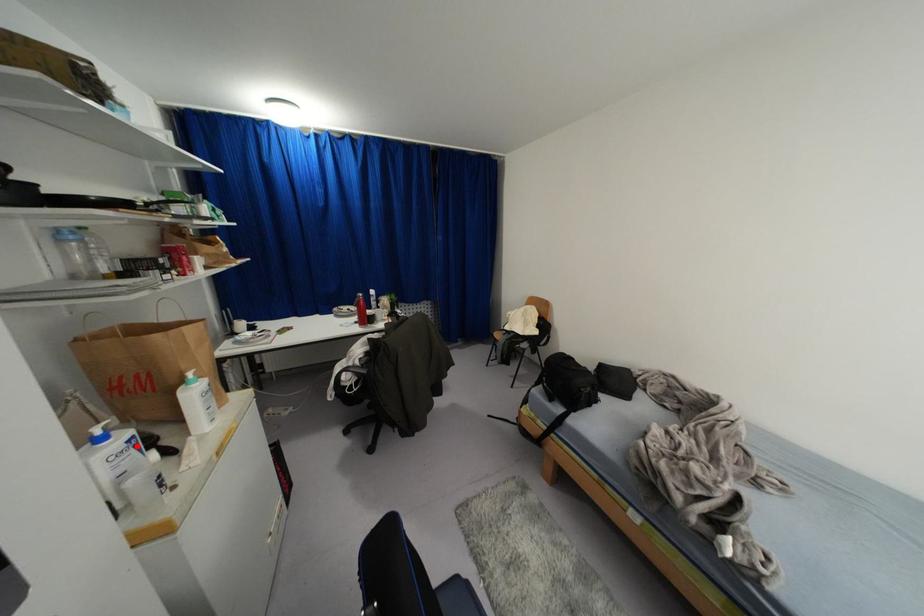
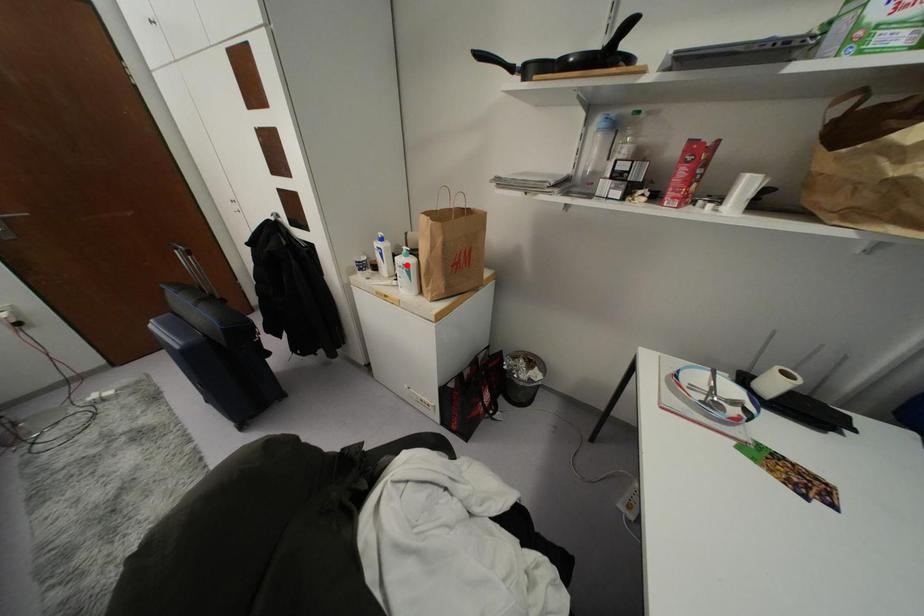
I am providing you with two images of the same scene from different viewpoints. A red point is marked on the first image and another point is marked on the second image. Is the red point in image1 aligned with the point shown in image2?

No